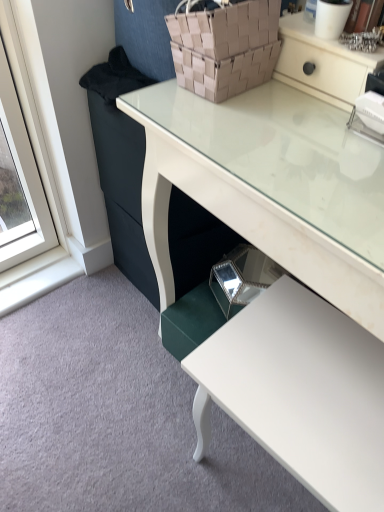
Question: Can you confirm if brown woven basket at upper center is wider than white glossy desk at center?

Choices:
 (A) yes
 (B) no

Answer: (B)

Question: Does brown woven basket at upper center lie behind white glossy desk at center?

Choices:
 (A) yes
 (B) no

Answer: (A)

Question: Does brown woven basket at upper center turn towards white glossy desk at center?

Choices:
 (A) yes
 (B) no

Answer: (B)

Question: Considering the relative sizes of brown woven basket at upper center and white glossy desk at center in the image provided, is brown woven basket at upper center shorter than white glossy desk at center?

Choices:
 (A) no
 (B) yes

Answer: (B)

Question: Considering the relative sizes of brown woven basket at upper center and white glossy desk at center in the image provided, is brown woven basket at upper center smaller than white glossy desk at center?

Choices:
 (A) no
 (B) yes

Answer: (B)

Question: From their relative heights in the image, would you say white glossy desk at center is taller or shorter than white glossy table at lower right?

Choices:
 (A) tall
 (B) short

Answer: (A)

Question: Is white glossy desk at center situated inside white glossy table at lower right or outside?

Choices:
 (A) outside
 (B) inside

Answer: (A)

Question: From a real-world perspective, is white glossy desk at center positioned above or below white glossy table at lower right?

Choices:
 (A) below
 (B) above

Answer: (B)

Question: Would you say white glossy desk at center is to the left or to the right of white glossy table at lower right in the picture?

Choices:
 (A) left
 (B) right

Answer: (B)

Question: In terms of height, does white glossy table at lower right look taller or shorter compared to brown woven basket at upper center?

Choices:
 (A) short
 (B) tall

Answer: (B)

Question: From a real-world perspective, is white glossy table at lower right above or below brown woven basket at upper center?

Choices:
 (A) below
 (B) above

Answer: (A)

Question: Considering the positions of point (337, 318) and point (261, 54), is point (337, 318) closer or farther from the camera than point (261, 54)?

Choices:
 (A) farther
 (B) closer

Answer: (A)

Question: Would you say white glossy table at lower right is to the left or to the right of brown woven basket at upper center in the picture?

Choices:
 (A) left
 (B) right

Answer: (B)

Question: Choose the correct answer: Is brown woven basket at upper center inside white glossy table at lower right or outside it?

Choices:
 (A) outside
 (B) inside

Answer: (A)

Question: Based on their positions, is brown woven basket at upper center located to the left or right of white glossy table at lower right?

Choices:
 (A) right
 (B) left

Answer: (B)